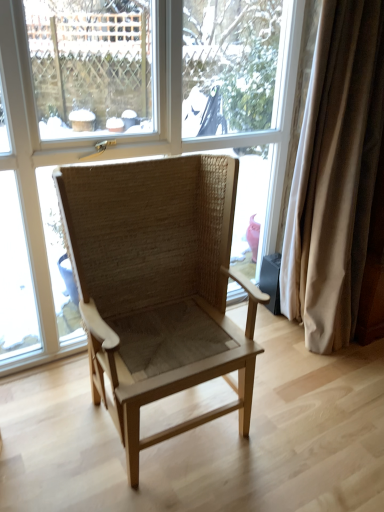
Question: Is natural woven chair at center positioned far away from beige fabric curtain at right?

Choices:
 (A) no
 (B) yes

Answer: (A)

Question: Is natural woven chair at center taller than beige fabric curtain at right?

Choices:
 (A) no
 (B) yes

Answer: (A)

Question: Is natural woven chair at center further to the viewer compared to beige fabric curtain at right?

Choices:
 (A) yes
 (B) no

Answer: (B)

Question: Is beige fabric curtain at right surrounded by natural woven chair at center?

Choices:
 (A) yes
 (B) no

Answer: (B)

Question: From a real-world perspective, is natural woven chair at center below beige fabric curtain at right?

Choices:
 (A) yes
 (B) no

Answer: (A)

Question: Based on their positions, is transparent glass window at center located to the left or right of natural woven chair at center?

Choices:
 (A) left
 (B) right

Answer: (A)

Question: Considering the positions of transparent glass window at center and natural woven chair at center in the image, is transparent glass window at center wider or thinner than natural woven chair at center?

Choices:
 (A) thin
 (B) wide

Answer: (A)

Question: From a real-world perspective, is transparent glass window at center physically located above or below natural woven chair at center?

Choices:
 (A) above
 (B) below

Answer: (A)

Question: Is transparent glass window at center inside or outside of natural woven chair at center?

Choices:
 (A) inside
 (B) outside

Answer: (B)

Question: Looking at their shapes, would you say natural woven chair at center is wider or thinner than transparent glass window at center?

Choices:
 (A) thin
 (B) wide

Answer: (B)

Question: In the image, is natural woven chair at center on the left side or the right side of transparent glass window at center?

Choices:
 (A) right
 (B) left

Answer: (A)

Question: Do you think natural woven chair at center is within transparent glass window at center, or outside of it?

Choices:
 (A) inside
 (B) outside

Answer: (B)

Question: From the image's perspective, is natural woven chair at center located above or below transparent glass window at center?

Choices:
 (A) above
 (B) below

Answer: (B)

Question: From the image's perspective, is beige fabric curtain at right located above or below natural woven chair at center?

Choices:
 (A) below
 (B) above

Answer: (B)

Question: Would you say beige fabric curtain at right is to the left or to the right of natural woven chair at center in the picture?

Choices:
 (A) right
 (B) left

Answer: (A)